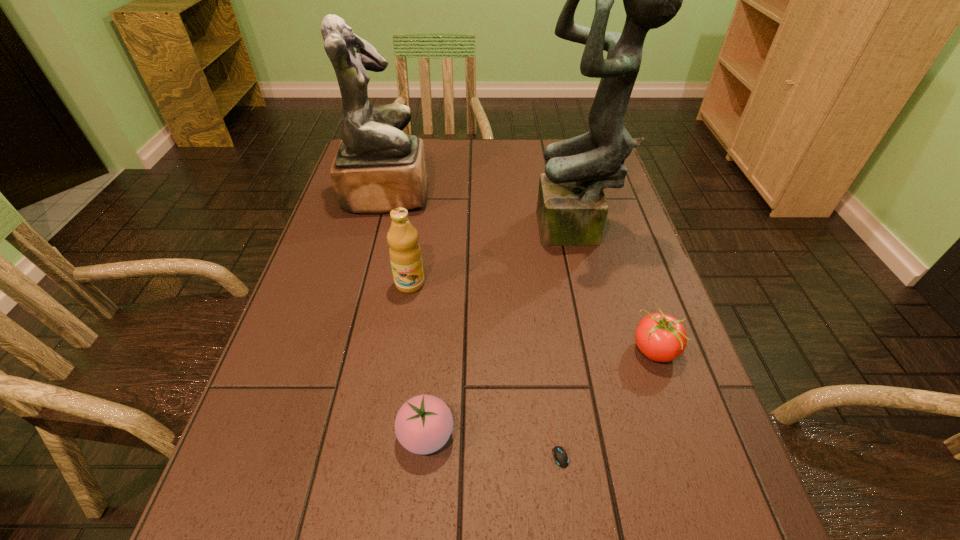
You are a GUI agent. You are given a task and a screenshot of the screen. Output one action in this format:
    pyautogui.click(x=<x>, y=<y>)
    Task: Click on the vacant region between the fourth shortest object and the mouse
    
    Given the screenshot: What is the action you would take?
    pyautogui.click(x=484, y=363)

Where is `vacant space that's between the left tomato and the mouse`? This screenshot has width=960, height=540. vacant space that's between the left tomato and the mouse is located at coordinates click(492, 439).

Where is `vacant area that lies between the nearer tomato and the mouse`? vacant area that lies between the nearer tomato and the mouse is located at coordinates (492, 439).

Locate an element on the screen. empty space that is in between the right sculpture and the farther tomato is located at coordinates (616, 291).

Image resolution: width=960 pixels, height=540 pixels. Identify the location of empty location between the fourth nearest object and the left tomato. (418, 359).

Find the location of `free area in between the nearer tomato and the left sculpture`. free area in between the nearer tomato and the left sculpture is located at coordinates (407, 315).

This screenshot has width=960, height=540. Identify the location of object identified as the fourth closest to the farther tomato. (405, 254).

At what (x,y) coordinates should I click in order to perform the action: click on the second closest object to the right sculpture. Please return your answer as a coordinate pair (x, y). Image resolution: width=960 pixels, height=540 pixels. Looking at the image, I should click on (405, 254).

Where is `vacant area that satisfies the following two spatial constraints: 1. on the back side of the third nearest object; 2. on the left side of the shortest object`? Image resolution: width=960 pixels, height=540 pixels. vacant area that satisfies the following two spatial constraints: 1. on the back side of the third nearest object; 2. on the left side of the shortest object is located at coordinates (545, 349).

At what (x,y) coordinates should I click in order to perform the action: click on free space that satisfies the following two spatial constraints: 1. on the label of the left tomato; 2. on the left side of the olive oil. Please return your answer as a coordinate pair (x, y). This screenshot has width=960, height=540. Looking at the image, I should click on (386, 435).